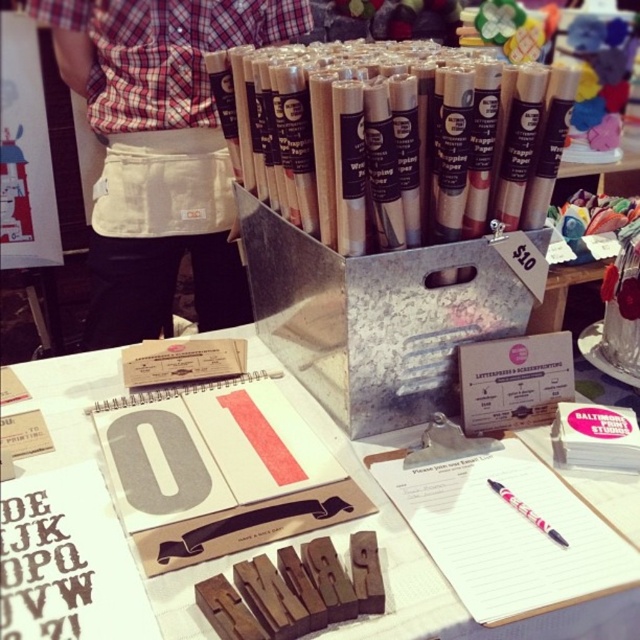
Can you confirm if wooden wrapping paper rolls at upper center is positioned to the right of wooden letterpress blocks at center?

Yes, wooden wrapping paper rolls at upper center is to the right of wooden letterpress blocks at center.

Is point (378, 109) positioned in front of point (44, 410)?

Yes, point (378, 109) is closer to viewer.

Between point (323, 74) and point (412, 440), which one is positioned behind?

Point (412, 440)

Locate an element on the screen. wooden wrapping paper rolls at upper center is located at coordinates (394, 138).